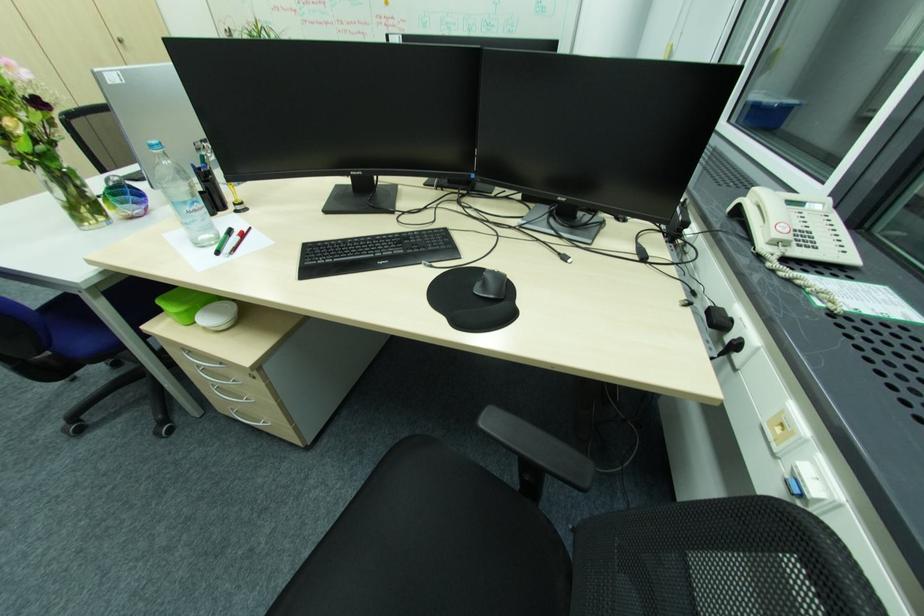
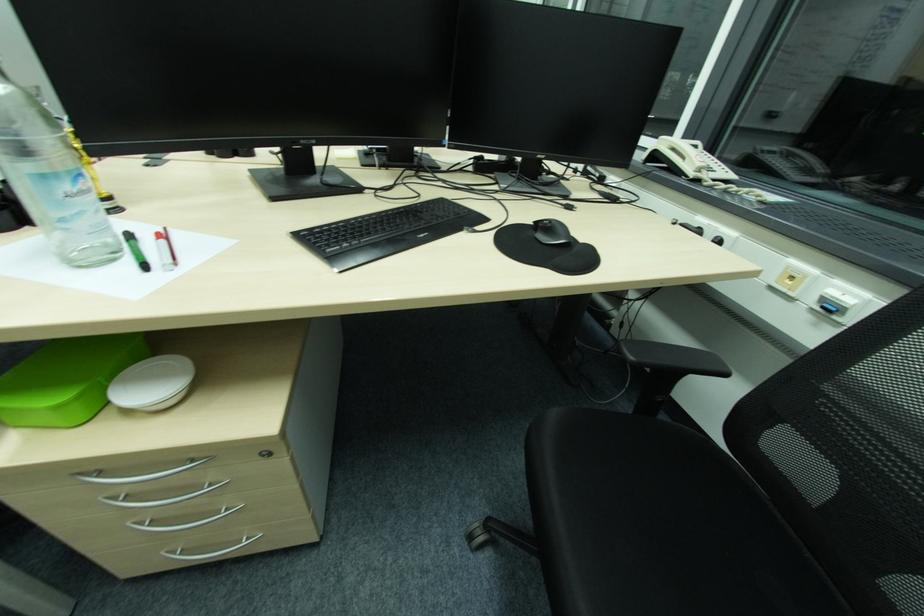
Where in the second image is the point corresponding to (x=245, y=238) from the first image?

(167, 241)